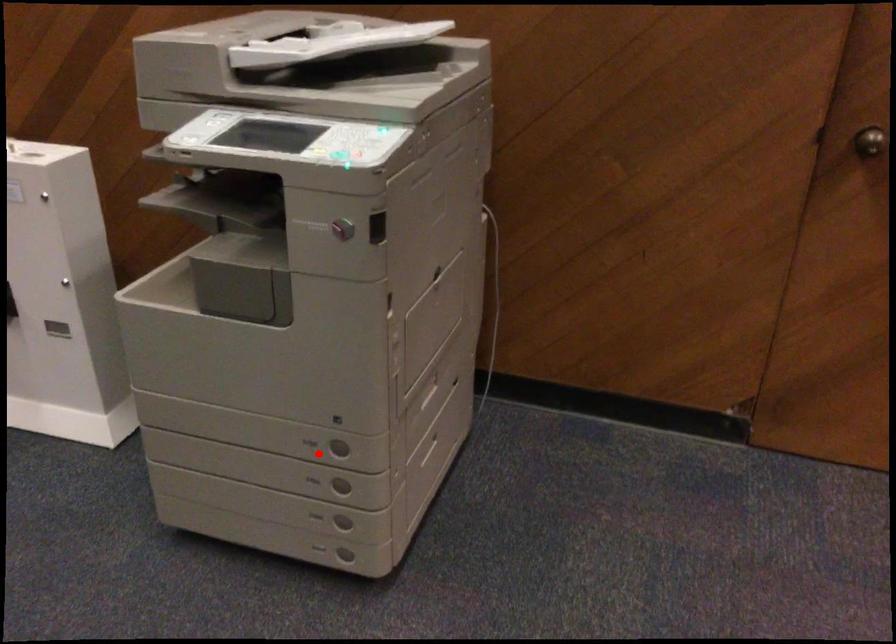
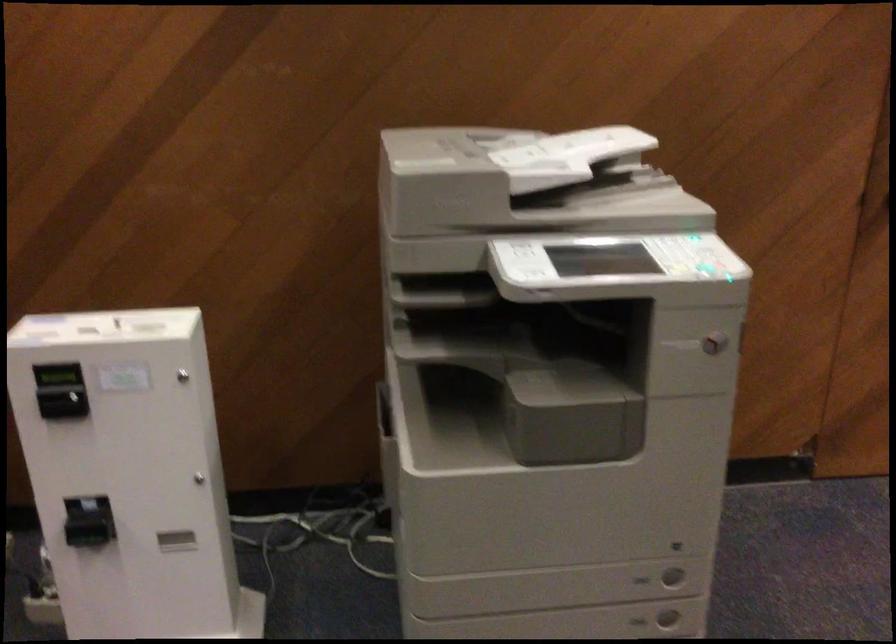
Question: I am providing you with two images of the same scene from different viewpoints. A red point is marked on the first image. At the location where the point appears in image 1, is it still visible in image 2?

Choices:
 (A) Yes
 (B) No

Answer: (A)